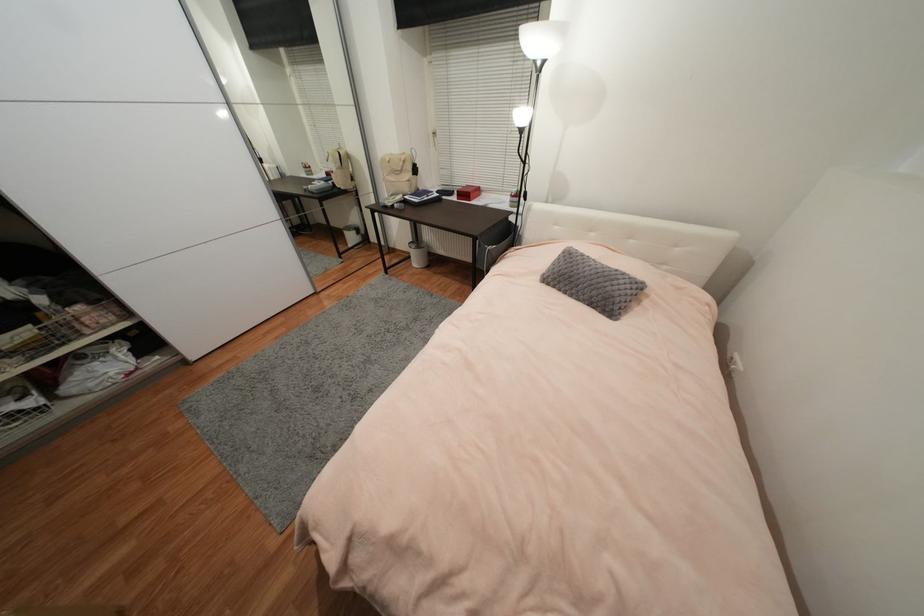
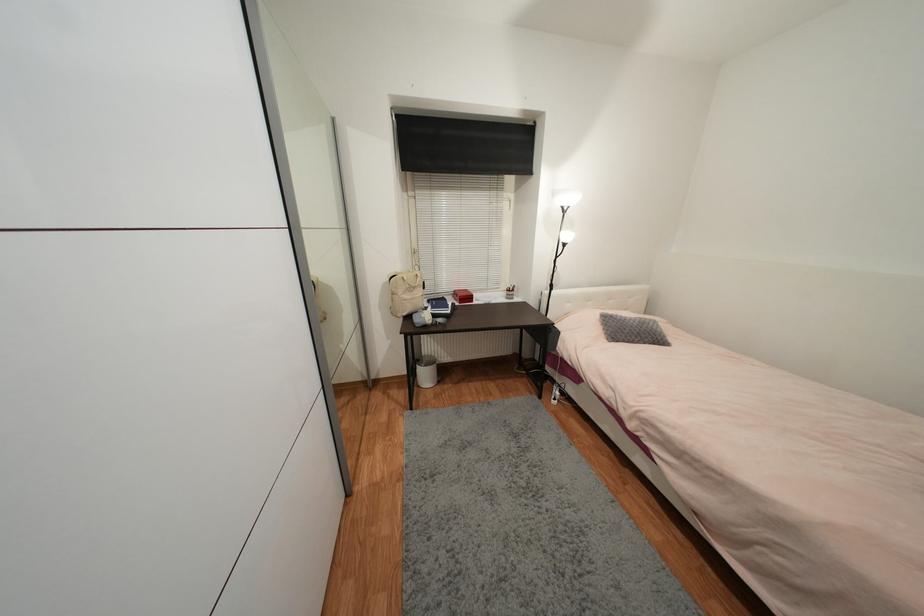
Find the pixel in the second image that matches point (591, 274) in the first image.

(639, 326)